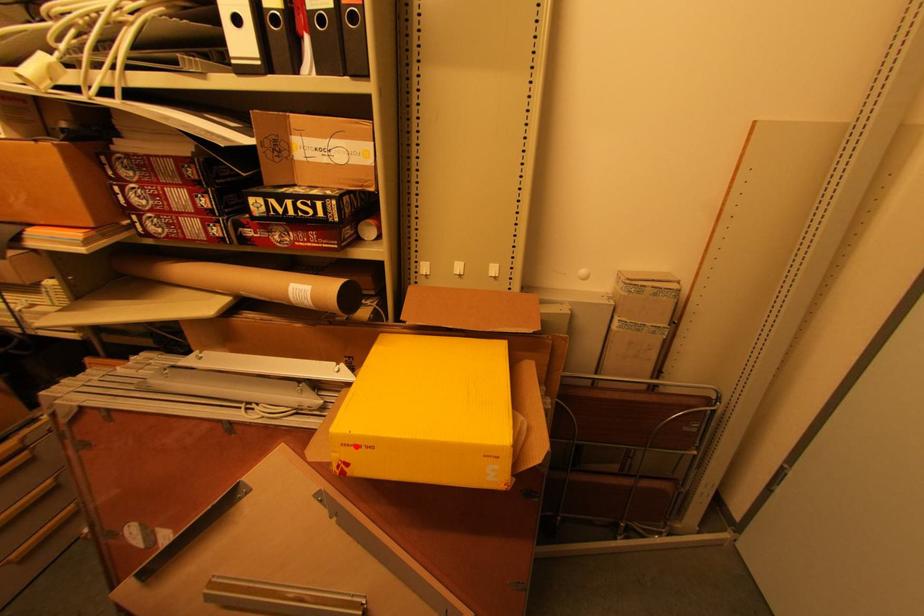
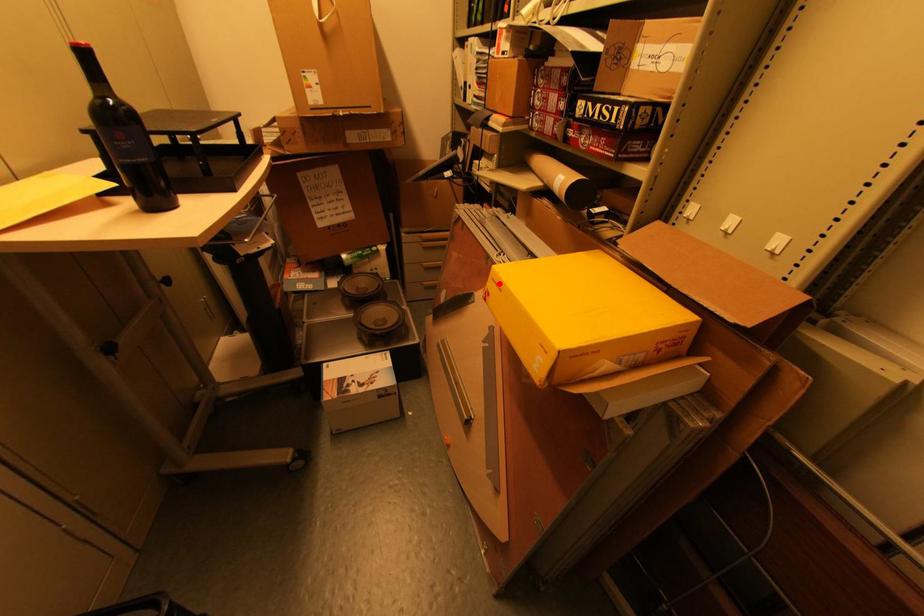
I am providing you with two images of the same scene from different viewpoints. A red point is marked on the first image and another point is marked on the second image. Is the marked point in image1 the same physical position as the marked point in image2?

Yes